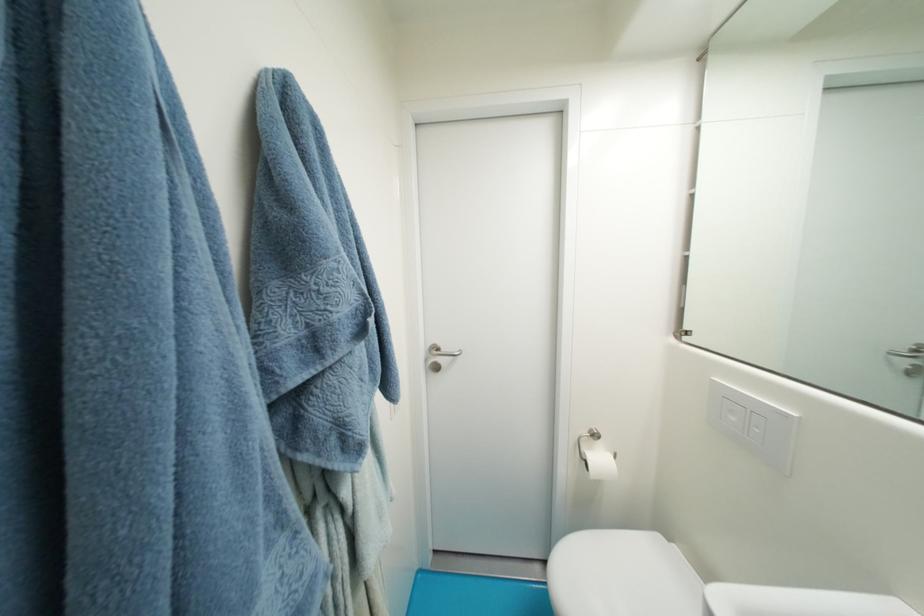
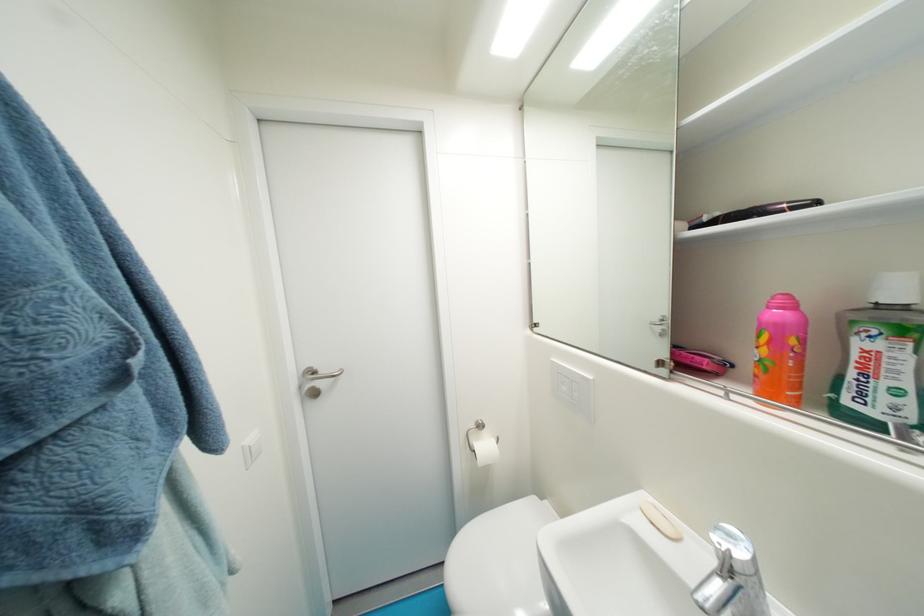
In the second image, find the point that corresponds to the point at 738,421 in the first image.

(570, 390)